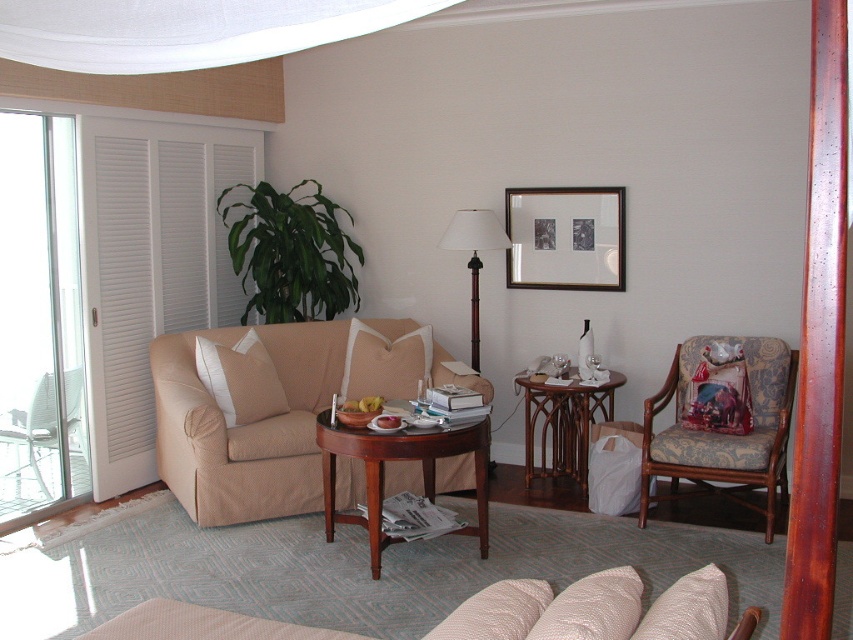
Question: Does beige fabric couch at center appear on the left side of green leafy plant at upper left?

Choices:
 (A) yes
 (B) no

Answer: (B)

Question: Does white louvered door at left lie in front of woodenside table at right?

Choices:
 (A) no
 (B) yes

Answer: (B)

Question: Is green leafy plant at upper left positioned before beige textured pillow at center?

Choices:
 (A) yes
 (B) no

Answer: (B)

Question: Among these objects, which one is nearest to the camera?

Choices:
 (A) beige textured pillow at center
 (B) beige fabric couch at lower center

Answer: (B)

Question: Which point appears closest to the camera in this image?

Choices:
 (A) (352, 10)
 (B) (283, 637)
 (C) (410, 435)

Answer: (A)

Question: Which of the following is the farthest from the observer?

Choices:
 (A) (555, 429)
 (B) (143, 131)

Answer: (A)